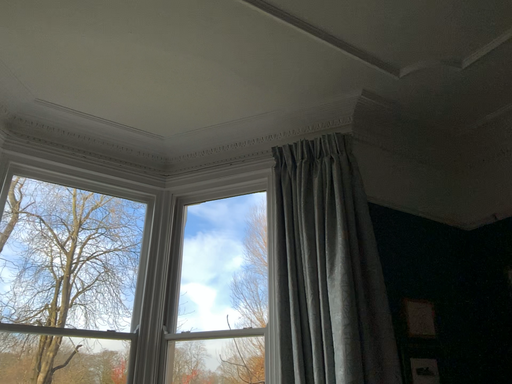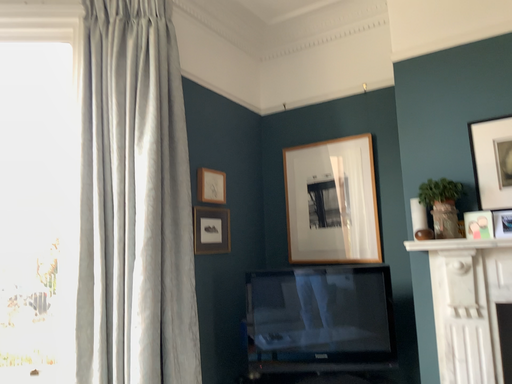
Question: Which way did the camera rotate in the video?

Choices:
 (A) rotated downward
 (B) rotated upward

Answer: (A)